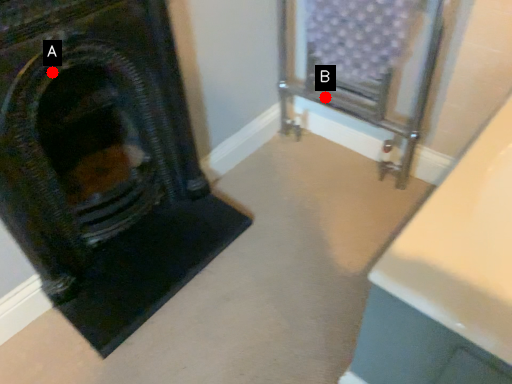
Question: Two points are circled on the image, labeled by A and B beside each circle. Which point is closer to the camera taking this photo?

Choices:
 (A) A is closer
 (B) B is closer

Answer: (A)